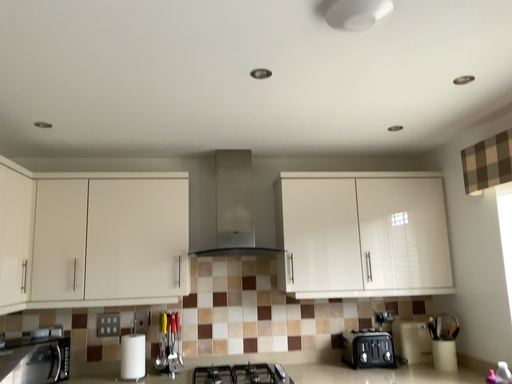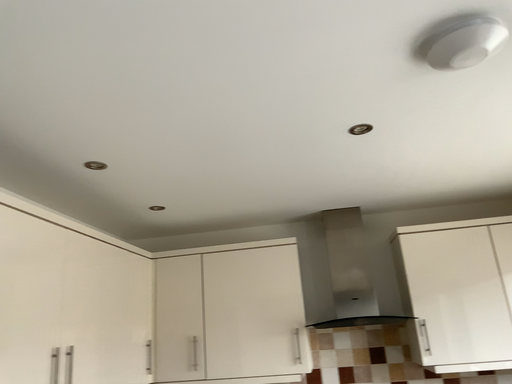
Question: How did the camera likely rotate when shooting the video?

Choices:
 (A) rotated upward
 (B) rotated downward

Answer: (A)